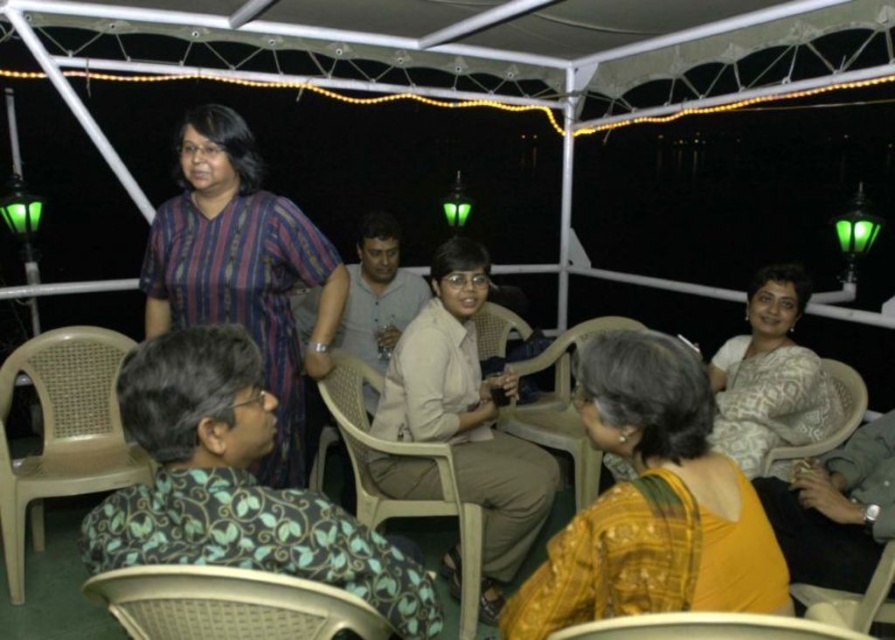
Question: Does printed fabric shirt at lower left have a lesser width compared to light gray fabric jacket at lower right?

Choices:
 (A) yes
 (B) no

Answer: (B)

Question: Which of the following is the farthest from the observer?

Choices:
 (A) (478, 413)
 (B) (158, 369)
 (C) (32, 497)
 (D) (618, 500)

Answer: (A)

Question: Which point is farther to the camera?

Choices:
 (A) (813, 490)
 (B) (378, 211)
 (C) (263, 301)
 (D) (709, 371)

Answer: (B)

Question: Can you confirm if beige fabric pants at center is positioned to the left of matte plastic chair at lower right?

Choices:
 (A) yes
 (B) no

Answer: (A)

Question: Which of the following is the farthest from the observer?

Choices:
 (A) light beige fabric shirt at center
 (B) white patterned saree at center
 (C) patterned fabric chair at lower right

Answer: (A)

Question: Does beige plastic chair at center appear under patterned fabric chair at lower right?

Choices:
 (A) no
 (B) yes

Answer: (B)